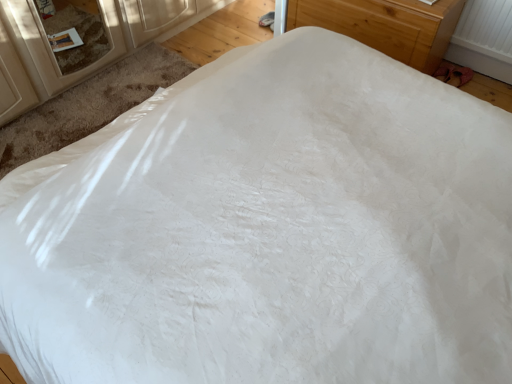
What do you see at coordinates (386, 25) in the screenshot? I see `white fabric bed at upper right` at bounding box center [386, 25].

The height and width of the screenshot is (384, 512). Find the location of `white fabric bed at upper right`. white fabric bed at upper right is located at coordinates (386, 25).

Measure the distance between white fabric bed at upper right and camera.

The depth of white fabric bed at upper right is 6.14 feet.

In order to click on white fabric bed at upper right in this screenshot , I will do `click(386, 25)`.